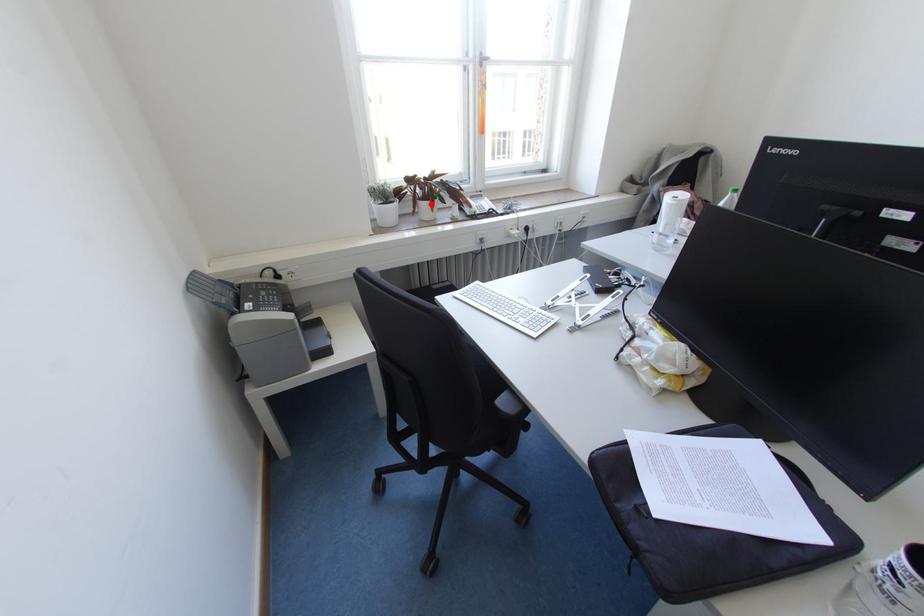
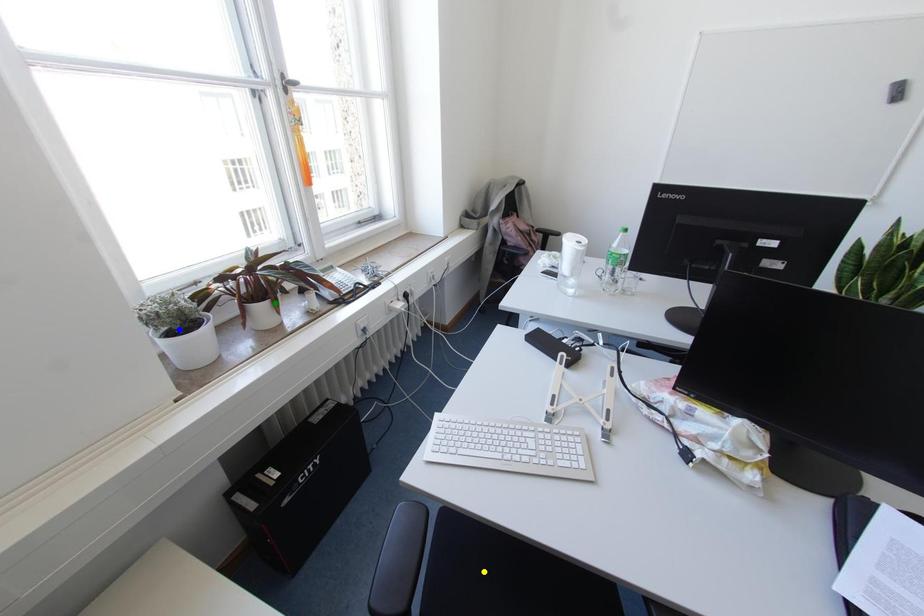
Question: I am providing you with two images of the same scene from different viewpoints. A red point is marked on the first image. You are given multiple points on the second image. Which mark in image 2 goes with the point in image 1?

Choices:
 (A) green point
 (B) yellow point
 (C) blue point

Answer: (A)